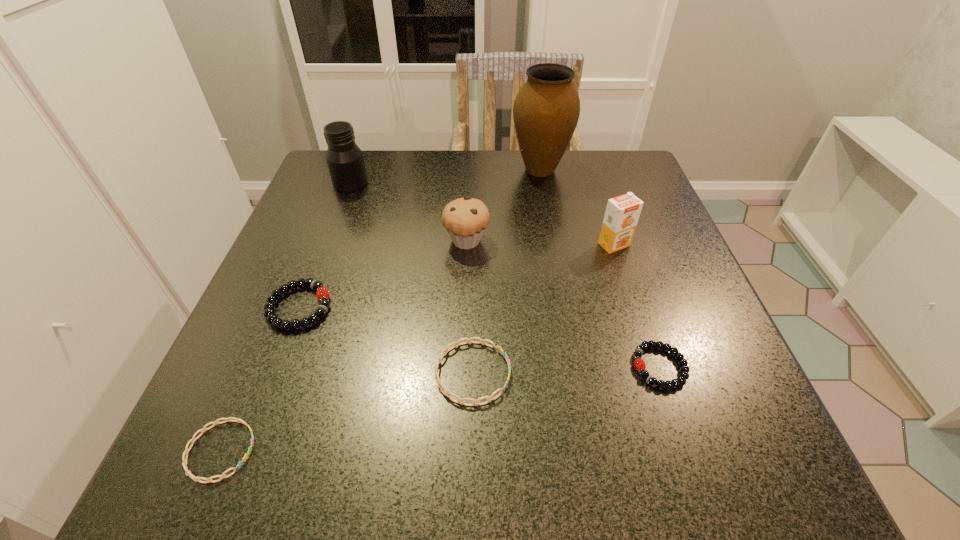
The width and height of the screenshot is (960, 540). I want to click on the third closest bracelet to the nearer black bracelet, so coord(184,463).

Locate an element on the screen. The height and width of the screenshot is (540, 960). free space that satisfies the following two spatial constraints: 1. on the front side of the right black bracelet; 2. on the right side of the left black bracelet is located at coordinates (276, 367).

The height and width of the screenshot is (540, 960). Find the location of `free point that satisfies the following two spatial constraints: 1. on the front side of the seventh shortest object; 2. on the left side of the muffin`. free point that satisfies the following two spatial constraints: 1. on the front side of the seventh shortest object; 2. on the left side of the muffin is located at coordinates (329, 241).

In order to click on vacant region that satisfies the following two spatial constraints: 1. on the front side of the orange orange juice; 2. on the left side of the seventh shortest object in this screenshot , I will do `click(328, 245)`.